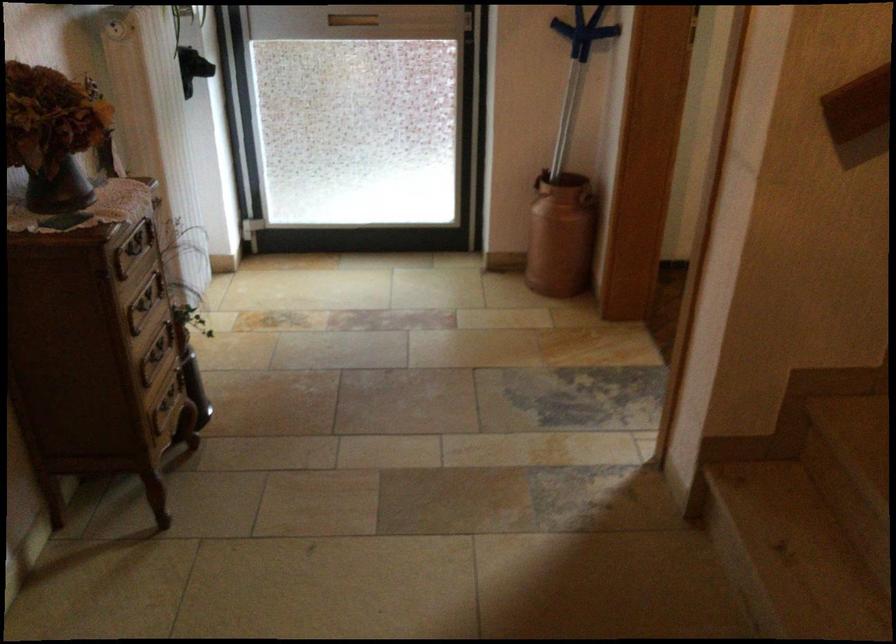
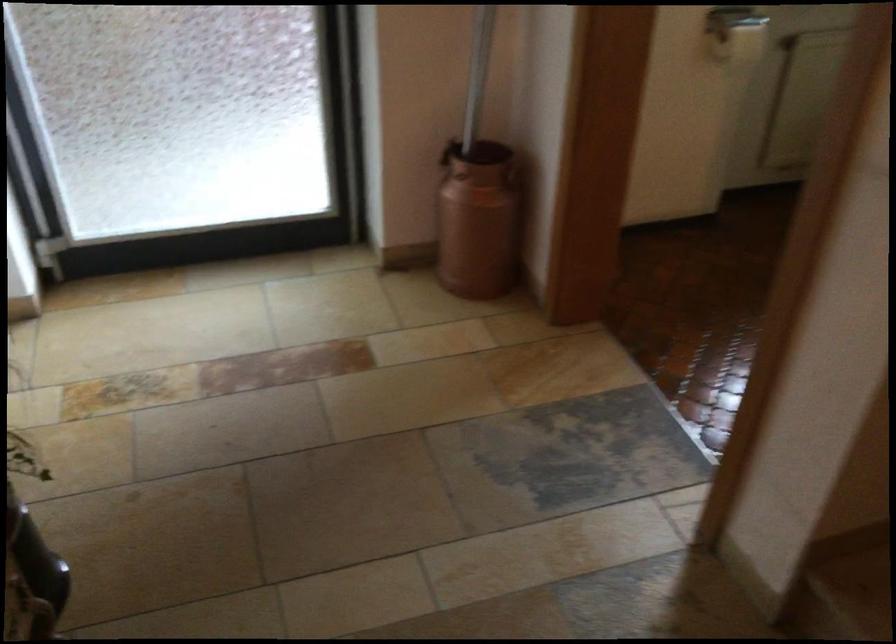
In the second image, find the point that corresponds to the point at 581,198 in the first image.

(513, 176)